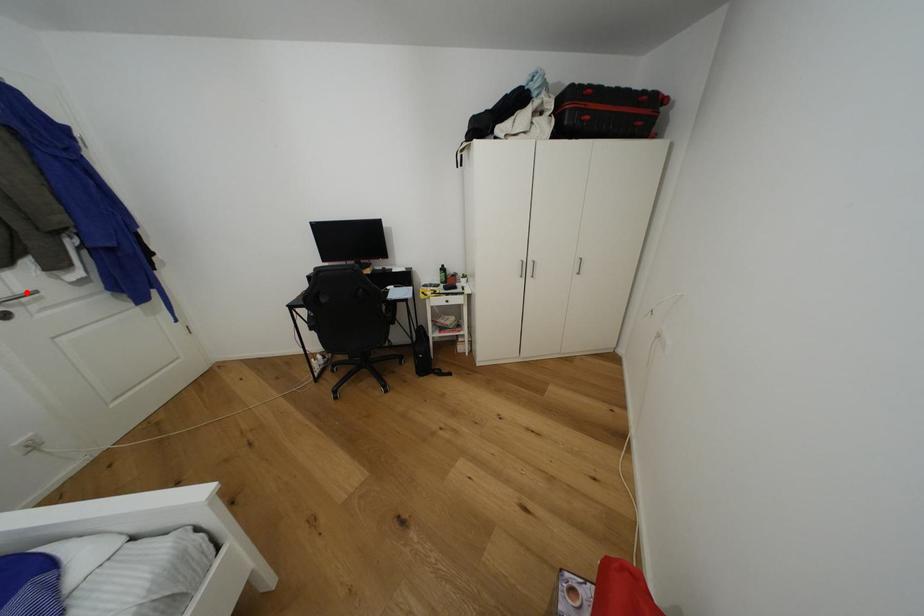
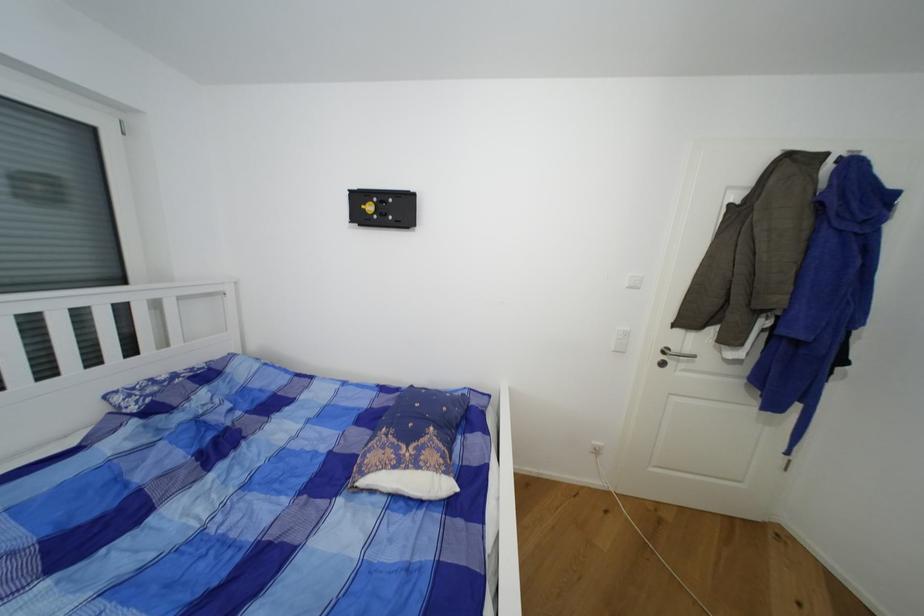
Where in the second image is the point corresponding to the highlighted location from the first image?

(691, 352)